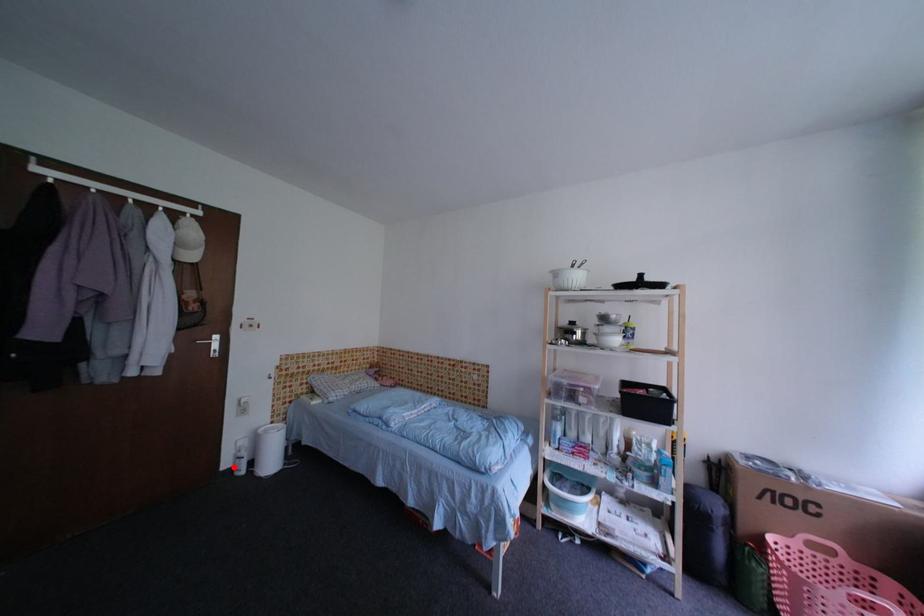
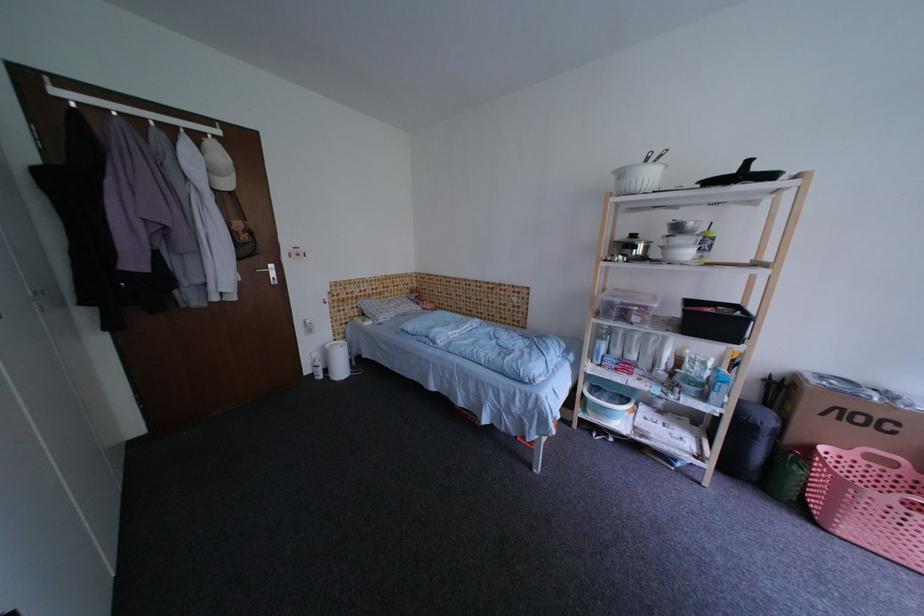
Find the pixel in the second image that matches the highlighted location in the first image.

(314, 374)